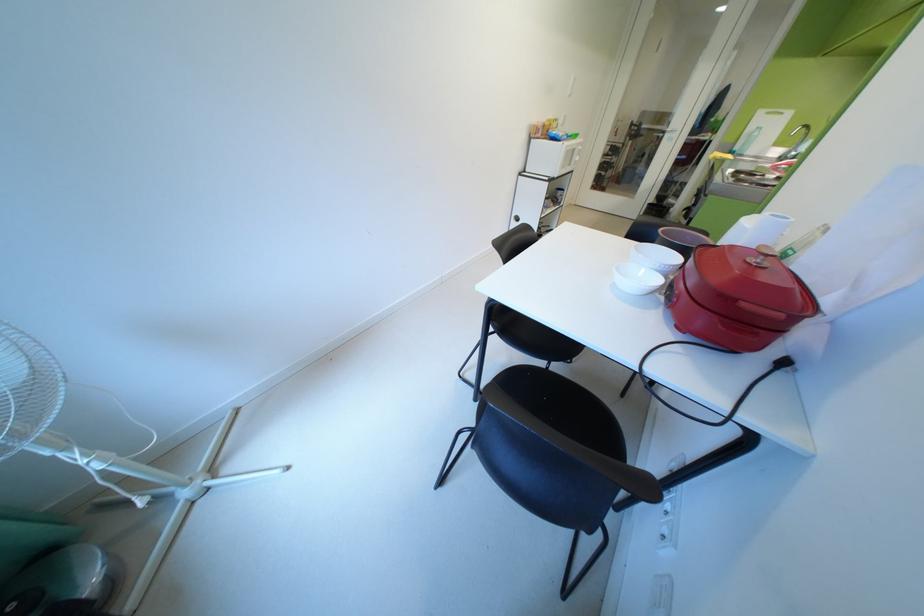
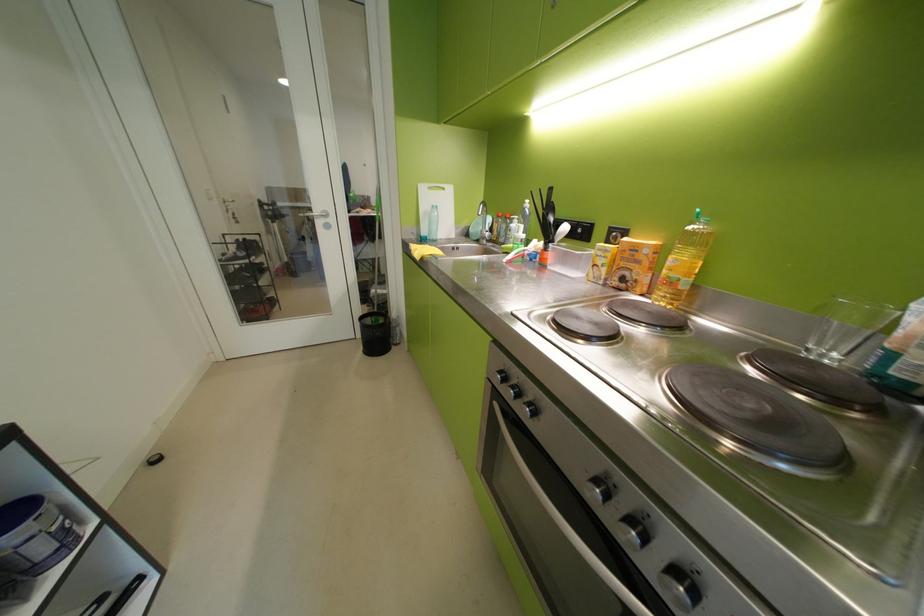
Locate, in the second image, the point that corresponds to (x=747, y=148) in the first image.

(433, 233)